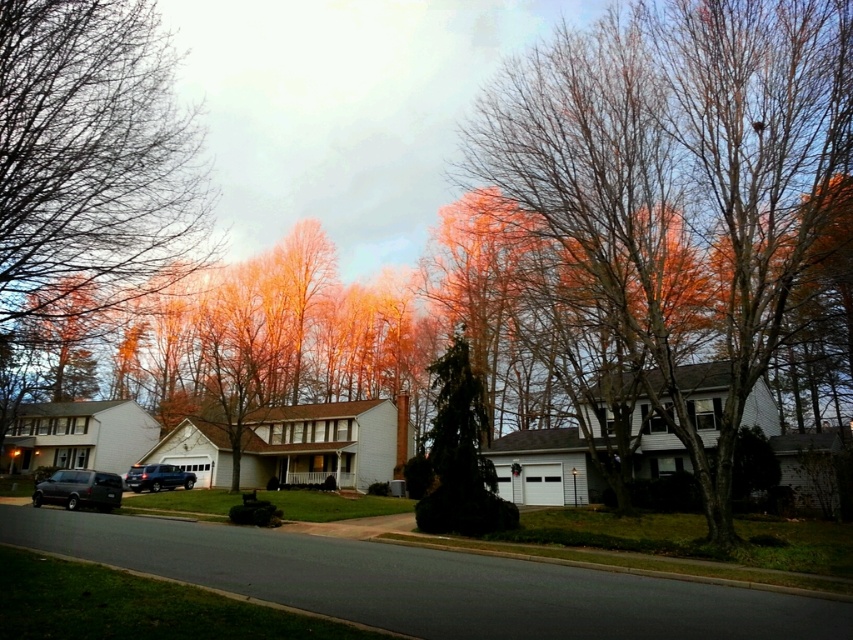
Question: Which point is closer to the camera?

Choices:
 (A) satin black suv at center
 (B) green textured evergreen tree at center

Answer: (B)

Question: Does green textured evergreen tree at center appear under satin black suv at center?

Choices:
 (A) no
 (B) yes

Answer: (A)

Question: Can you confirm if bare branches at center is positioned to the left of satin black suv at center?

Choices:
 (A) no
 (B) yes

Answer: (A)

Question: Is bare branches at center bigger than matte black van at lower left?

Choices:
 (A) no
 (B) yes

Answer: (B)

Question: Which of these objects is positioned farthest from the bare branches at center?

Choices:
 (A) green textured evergreen tree at center
 (B) satin black suv at center
 (C) matte black van at lower left

Answer: (B)

Question: Which point is closer to the camera?

Choices:
 (A) (814, 182)
 (B) (84, 490)
 (C) (177, 484)

Answer: (A)